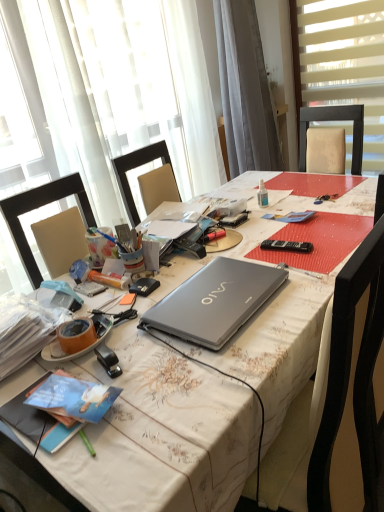
The image size is (384, 512). What do you see at coordinates (287, 246) in the screenshot?
I see `black plastic remote control at center` at bounding box center [287, 246].

What do you see at coordinates (162, 435) in the screenshot?
I see `metallic silver laptop at center` at bounding box center [162, 435].

What do you see at coordinates (108, 360) in the screenshot? I see `black plastic stapler at lower left` at bounding box center [108, 360].

What are the coordinates of `blue matte book at lower left, which ranks as the first book in bottom-to-top order` in the screenshot? It's located at (37, 422).

This screenshot has height=512, width=384. What do you see at coordinates (245, 90) in the screenshot?
I see `gray fabric curtain at upper center` at bounding box center [245, 90].

This screenshot has width=384, height=512. What are the coordinates of `gray fabric curtain at upper center` in the screenshot? It's located at (245, 90).

You are a GUI agent. You are given a task and a screenshot of the screen. Output one action in this format:
    pyautogui.click(x=<x>, y=<y>)
    Task: Click on the clear plastic bottle at center
    This screenshot has height=512, width=384.
    Given the screenshot: What is the action you would take?
    pyautogui.click(x=262, y=194)

Is clear plastic bottle at center inside blue paperback book at lower left, acting as the 1th book starting from the top?

That's incorrect, clear plastic bottle at center is not inside blue paperback book at lower left, acting as the 1th book starting from the top.

Identify the location of bottle above the blue paperback book at lower left, acting as the 1th book starting from the top (from a real-world perspective). (262, 194).

How many degrees apart are the facing directions of blue paperback book at lower left, acting as the 1th book starting from the top, and clear plastic bottle at center?

The facing directions of blue paperback book at lower left, acting as the 1th book starting from the top, and clear plastic bottle at center are 17.3 degrees apart.

From a real-world perspective, is blue paperback book at lower left, the 2th book positioned from the bottom, located beneath clear plastic bottle at center?

Yes, from a real-world perspective, blue paperback book at lower left, the 2th book positioned from the bottom, is under clear plastic bottle at center.

Considering the sizes of blue paperback book at lower left, the 2th book positioned from the bottom, and gray fabric curtain at upper center in the image, is blue paperback book at lower left, the 2th book positioned from the bottom, wider or thinner than gray fabric curtain at upper center?

blue paperback book at lower left, the 2th book positioned from the bottom, is thinner than gray fabric curtain at upper center.

Is gray fabric curtain at upper center surrounded by blue paperback book at lower left, the 2th book positioned from the bottom?

No, gray fabric curtain at upper center is not surrounded by blue paperback book at lower left, the 2th book positioned from the bottom.

From the image's perspective, count 1st books downward from the gray fabric curtain at upper center and point to it. Please provide its 2D coordinates.

[(72, 398)]

From a real-world perspective, is blue paperback book at lower left, acting as the 1th book starting from the top, physically above gray fabric curtain at upper center?

Incorrect, from a real-world perspective, blue paperback book at lower left, acting as the 1th book starting from the top, is lower than gray fabric curtain at upper center.

Is silver metallic laptop at center thinner than blue matte book at lower left, which ranks as the first book in bottom-to-top order?

No.

From a real-world perspective, between silver metallic laptop at center and blue matte book at lower left, which is counted as the 2th book, starting from the top, who is vertically higher?

In real-world perspective, silver metallic laptop at center is above.

Looking at this image, is silver metallic laptop at center smaller than blue matte book at lower left, which ranks as the first book in bottom-to-top order?

No, silver metallic laptop at center is not smaller than blue matte book at lower left, which ranks as the first book in bottom-to-top order.

Is silver metallic laptop at center looking in the opposite direction of blue matte book at lower left, which is counted as the 2th book, starting from the top?

No, silver metallic laptop at center is not facing the opposite direction of blue matte book at lower left, which is counted as the 2th book, starting from the top.

Is metallic silver laptop at center surrounded by translucent fabric at upper left, which appears as the second window when viewed from the right?

No, metallic silver laptop at center is not inside translucent fabric at upper left, which appears as the second window when viewed from the right.

Who is smaller, translucent fabric at upper left, placed as the 1th window when sorted from left to right, or metallic silver laptop at center?

translucent fabric at upper left, placed as the 1th window when sorted from left to right.

How many degrees apart are the facing directions of translucent fabric at upper left, placed as the 1th window when sorted from left to right, and metallic silver laptop at center?

4.63 degrees.

Are translucent fabric at upper left, placed as the 1th window when sorted from left to right, and metallic silver laptop at center far apart?

Indeed, translucent fabric at upper left, placed as the 1th window when sorted from left to right, is not near metallic silver laptop at center.

Which point is more forward, (95, 277) or (260, 200)?

Point (95, 277)

Looking at this image, is clear plastic bottle at center at the back of matte plastic pencil at center-left?

That's not correct — matte plastic pencil at center-left is not looking away from clear plastic bottle at center.

Do you think matte plastic pencil at center-left is within clear plastic bottle at center, or outside of it?

The correct answer is: outside.

What's the angular difference between matte plastic pencil at center-left and clear plastic bottle at center's facing directions?

6.35 degrees.

Is black plastic remote control at center next to black plastic stapler at lower left?

No, black plastic remote control at center is not in contact with black plastic stapler at lower left.

Does black plastic remote control at center come in front of black plastic stapler at lower left?

No, it is not.

Between black plastic remote control at center and black plastic stapler at lower left, which one has larger size?

With larger size is black plastic remote control at center.

Does point (34, 416) appear closer or farther from the camera than point (263, 302)?

Point (34, 416) is positioned closer to the camera compared to point (263, 302).

In the scene shown: Considering the positions of objects blue matte book at lower left, which is counted as the 2th book, starting from the top, and silver metallic laptop at center in the image provided, who is more to the left, blue matte book at lower left, which is counted as the 2th book, starting from the top, or silver metallic laptop at center?

Positioned to the left is blue matte book at lower left, which is counted as the 2th book, starting from the top.

Who is more distant, blue matte book at lower left, which ranks as the first book in bottom-to-top order, or silver metallic laptop at center?

silver metallic laptop at center.

Based on the photo, choose the correct answer: Is blue matte book at lower left, which is counted as the 2th book, starting from the top, inside silver metallic laptop at center or outside it?

The correct answer is: outside.

Image resolution: width=384 pixels, height=512 pixels. Find the location of `bottle on the right of the blue paperback book at lower left, the 2th book positioned from the bottom`. bottle on the right of the blue paperback book at lower left, the 2th book positioned from the bottom is located at coordinates (262, 194).

What are the coordinates of `the 1st book to the left when counting from the gray fabric curtain at upper center` in the screenshot? It's located at (72, 398).

Considering their positions, is metallic silver laptop at center positioned further to blue matte book at lower left, which is counted as the 2th book, starting from the top, than white blinds at upper right, which is the second window from left to right?

white blinds at upper right, which is the second window from left to right, lies further to blue matte book at lower left, which is counted as the 2th book, starting from the top, than the other object.

Based on their spatial positions, is clear plastic bottle at center or white blinds at upper right, which is the second window from left to right, closer to blue matte book at lower left, which is counted as the 2th book, starting from the top?

Among the two, clear plastic bottle at center is located nearer to blue matte book at lower left, which is counted as the 2th book, starting from the top.

Considering their positions, is blue paperback book at lower left, the 2th book positioned from the bottom, positioned closer to black plastic stapler at lower left than matte plastic pencil at center-left?

blue paperback book at lower left, the 2th book positioned from the bottom, is closer to black plastic stapler at lower left.

Based on their spatial positions, is blue paperback book at lower left, acting as the 1th book starting from the top, or silver metallic laptop at center further from black plastic remote control at center?

blue paperback book at lower left, acting as the 1th book starting from the top, is positioned further to the anchor black plastic remote control at center.

Based on their spatial positions, is black plastic remote control at center or blue matte book at lower left, which is counted as the 2th book, starting from the top, closer to translucent fabric at upper left, which appears as the second window when viewed from the right?

Among the two, black plastic remote control at center is located nearer to translucent fabric at upper left, which appears as the second window when viewed from the right.

Which object lies further to the anchor point metallic silver laptop at center, gray fabric curtain at upper center or blue matte book at lower left, which ranks as the first book in bottom-to-top order?

Based on the image, gray fabric curtain at upper center appears to be further to metallic silver laptop at center.

Looking at the image, which one is located closer to clear plastic bottle at center, black plastic remote control at center or matte plastic pencil at center-left?

black plastic remote control at center is closer to clear plastic bottle at center.

Which object lies nearer to the anchor point metallic silver laptop at center, gray fabric curtain at upper center or blue paperback book at lower left, acting as the 1th book starting from the top?

The object closer to metallic silver laptop at center is blue paperback book at lower left, acting as the 1th book starting from the top.

Where is `stationery between matte plastic pencil at center-left and black plastic remote control at center in the horizontal direction`? This screenshot has height=512, width=384. stationery between matte plastic pencil at center-left and black plastic remote control at center in the horizontal direction is located at coordinates (108, 360).

The height and width of the screenshot is (512, 384). Identify the location of mobile phone between metallic silver laptop at center and gray fabric curtain at upper center in the front-back direction. (287, 246).

You are a GUI agent. You are given a task and a screenshot of the screen. Output one action in this format:
    pyautogui.click(x=<x>, y=<y>)
    Task: Click on the remote control between black plastic stapler at lower left and black plastic remote control at center in the horizontal direction
    This screenshot has width=384, height=512.
    Given the screenshot: What is the action you would take?
    pyautogui.click(x=191, y=247)

You are a GUI agent. You are given a task and a screenshot of the screen. Output one action in this format:
    pyautogui.click(x=<x>, y=<y>)
    Task: Click on the remote control between matte plastic pencil at center-left and black plastic remote control at center
    Image resolution: width=384 pixels, height=512 pixels.
    Given the screenshot: What is the action you would take?
    pyautogui.click(x=191, y=247)